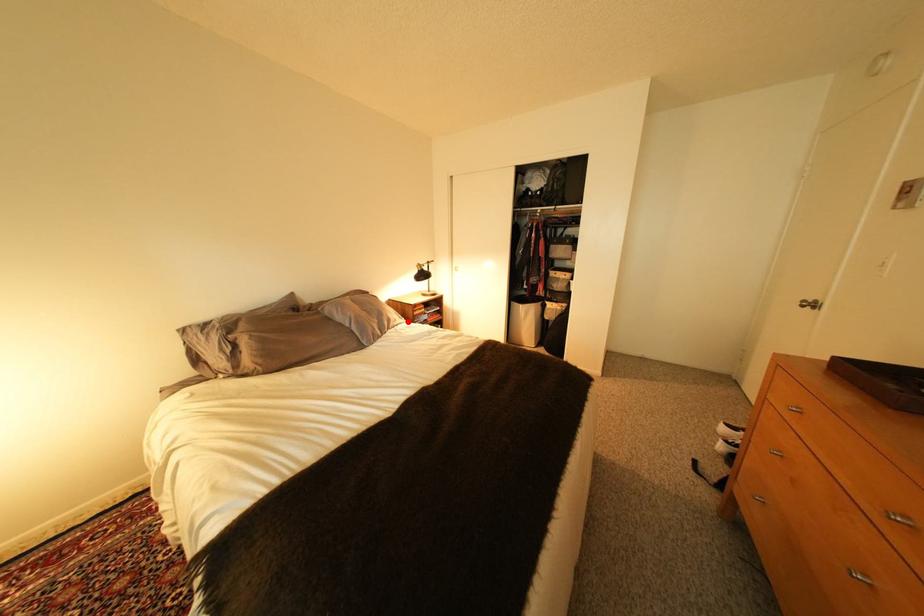
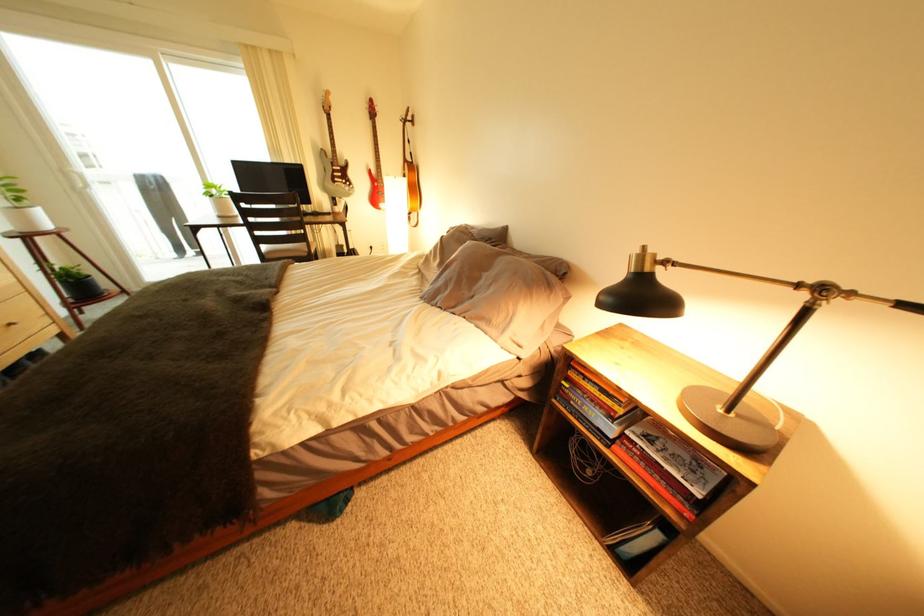
Where in the second image is the point corresponding to the highlighted location from the first image?

(503, 323)